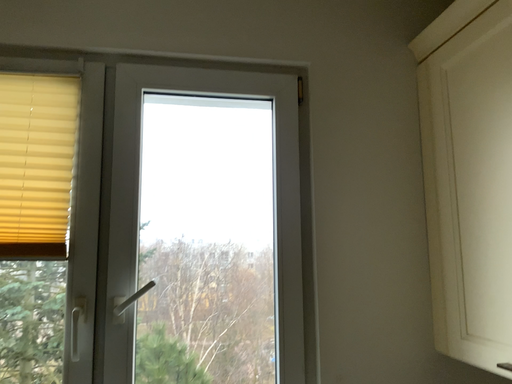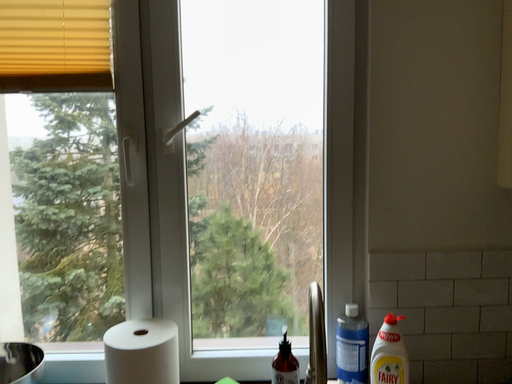
Question: Which way did the camera rotate in the video?

Choices:
 (A) rotated downward
 (B) rotated upward

Answer: (A)